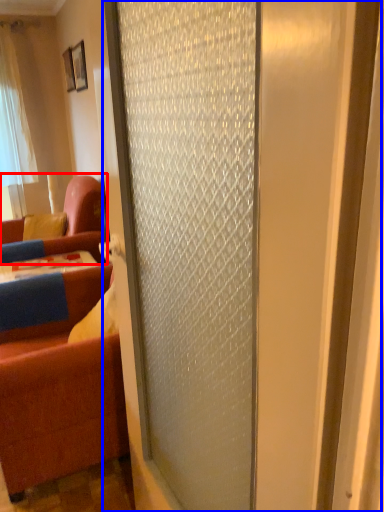
Question: Which point is closer to the camera, studio couch (highlighted by a red box) or door (highlighted by a blue box)?

Choices:
 (A) studio couch
 (B) door

Answer: (B)